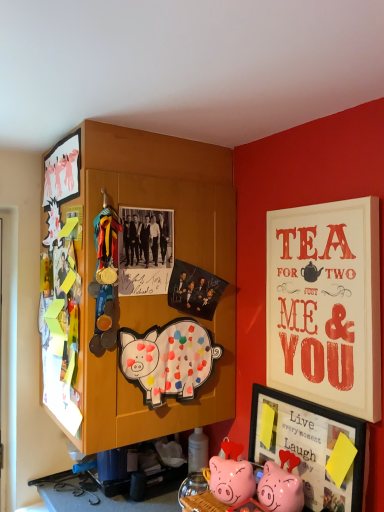
Question: Looking at their shapes, would you say pink glossy piggy bank at lower center, which ranks as the first toy in right-to-left order, is wider or thinner than matte white signboard at upper right, acting as the 2th picture frame starting from the bottom?

Choices:
 (A) thin
 (B) wide

Answer: (B)

Question: From the image's perspective, relative to matte white signboard at upper right, the 3th picture frame when ordered from left to right, is pink glossy piggy bank at lower center, which ranks as the first toy in right-to-left order, above or below?

Choices:
 (A) below
 (B) above

Answer: (A)

Question: Which object is the closest to the pink glossy piggy bank at lower center, which is counted as the second toy, starting from the left?

Choices:
 (A) wooden cabinet at upper left
 (B) matte white signboard at upper right, which ranks as the first picture frame in right-to-left order
 (C) pink glossy piggy bank at lower center, the second toy positioned from the right
 (D) painted paper pig at center
 (E) matte black picture frame at lower right, which is the second picture frame in left-to-right order

Answer: (C)

Question: Estimate the real-world distances between objects in this image. Which object is farther from the matte white signboard at upper right, which is the 2th picture frame in top-to-bottom order?

Choices:
 (A) pink glossy piggy bank at lower center, the first toy in the left-to-right sequence
 (B) matte black photo at upper center
 (C) matte white picture frame at upper left, which is counted as the third picture frame, starting from the bottom
 (D) pink glossy piggy bank at lower center, which ranks as the first toy in right-to-left order
 (E) painted paper pig at center

Answer: (C)